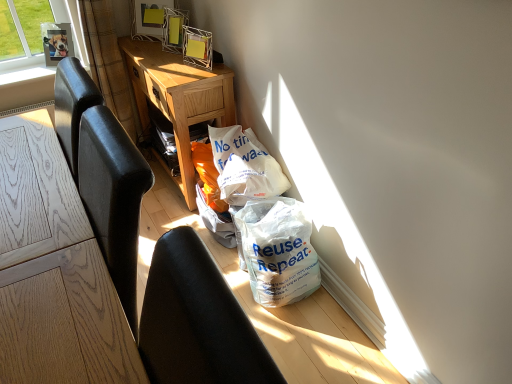
Question: Is metallic silver picture frame at upper left, acting as the 1th picture frame starting from the left, positioned in front of brown textured curtain at upper left?

Choices:
 (A) no
 (B) yes

Answer: (A)

Question: From a real-world perspective, is metallic silver picture frame at upper left, acting as the 1th picture frame starting from the left, on brown textured curtain at upper left?

Choices:
 (A) yes
 (B) no

Answer: (A)

Question: Is there a large distance between metallic silver picture frame at upper left, the second picture frame from the right, and brown textured curtain at upper left?

Choices:
 (A) yes
 (B) no

Answer: (B)

Question: Could you tell me if metallic silver picture frame at upper left, acting as the 1th picture frame starting from the left, is turned towards brown textured curtain at upper left?

Choices:
 (A) yes
 (B) no

Answer: (B)

Question: Is metallic silver picture frame at upper left, acting as the 1th picture frame starting from the left, wider than brown textured curtain at upper left?

Choices:
 (A) yes
 (B) no

Answer: (B)

Question: Is metallic silver picture frame at upper left, the second picture frame from the right, looking in the opposite direction of brown textured curtain at upper left?

Choices:
 (A) no
 (B) yes

Answer: (A)

Question: Can you confirm if white plastic bag at lower right is wider than brown textured curtain at upper left?

Choices:
 (A) yes
 (B) no

Answer: (A)

Question: Does white plastic bag at lower right come in front of brown textured curtain at upper left?

Choices:
 (A) yes
 (B) no

Answer: (A)

Question: Can you confirm if white plastic bag at lower right is taller than brown textured curtain at upper left?

Choices:
 (A) yes
 (B) no

Answer: (B)

Question: Is white plastic bag at lower right next to brown textured curtain at upper left?

Choices:
 (A) no
 (B) yes

Answer: (A)

Question: From the image's perspective, does white plastic bag at lower right appear lower than brown textured curtain at upper left?

Choices:
 (A) yes
 (B) no

Answer: (A)

Question: Could you tell me if white plastic bag at lower right is turned towards brown textured curtain at upper left?

Choices:
 (A) yes
 (B) no

Answer: (B)

Question: Is white plastic bag at lower right smaller than light oak desk at center?

Choices:
 (A) yes
 (B) no

Answer: (A)